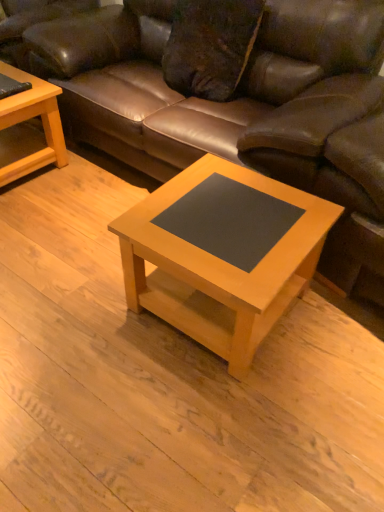
At what (x,y) coordinates should I click in order to perform the action: click on free space on the front side of light wood/black laminate coffee table at center, arranged as the 2th coffee table when viewed from the top. Please return your answer as a coordinate pair (x, y). Looking at the image, I should click on (215, 425).